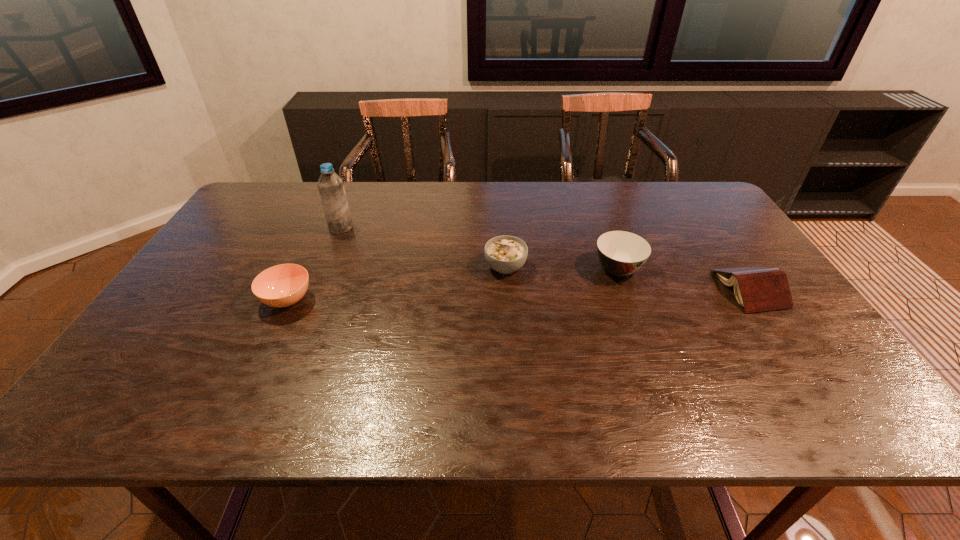
I want to click on the tallest object, so click(331, 188).

Locate an element on the screen. water bottle is located at coordinates (331, 188).

Identify the location of the fourth object from left to right. This screenshot has height=540, width=960. (621, 253).

The image size is (960, 540). I want to click on the third object from left to right, so click(506, 254).

You are a GUI agent. You are given a task and a screenshot of the screen. Output one action in this format:
    pyautogui.click(x=<x>, y=<y>)
    Task: Click on the leftmost soup bowl
    This screenshot has width=960, height=540.
    Given the screenshot: What is the action you would take?
    pyautogui.click(x=283, y=285)

This screenshot has height=540, width=960. Find the location of `book`. book is located at coordinates (757, 289).

Where is `free spot located 0.370m on the front of the farthest object`? This screenshot has width=960, height=540. free spot located 0.370m on the front of the farthest object is located at coordinates (302, 321).

Locate an element on the screen. The height and width of the screenshot is (540, 960). free space located 0.310m on the back of the fourth object from left to right is located at coordinates (592, 199).

The width and height of the screenshot is (960, 540). I want to click on vacant region located on the front of the third object from left to right, so click(x=515, y=408).

Where is `vacant space situated on the left of the leftmost soup bowl`? vacant space situated on the left of the leftmost soup bowl is located at coordinates (185, 300).